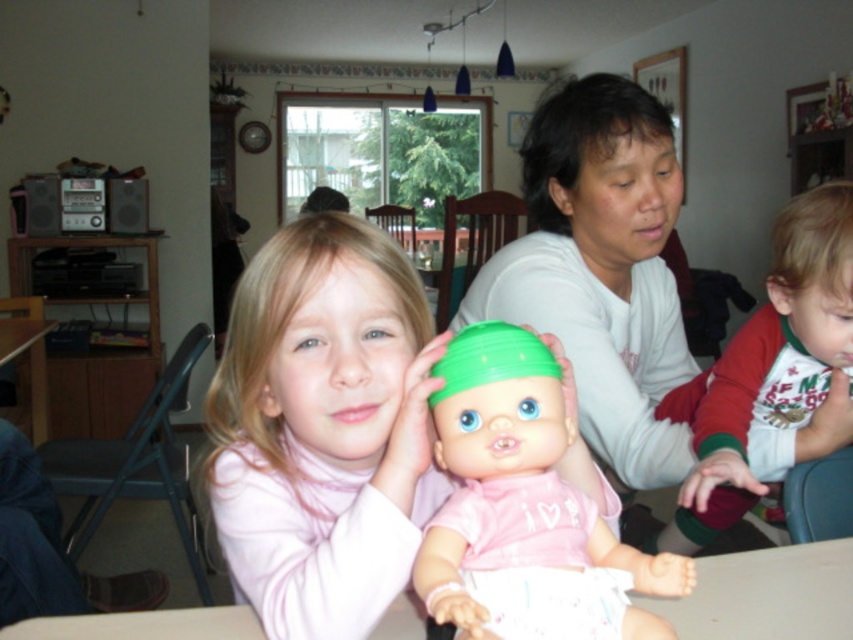
Between pink matte doll at center and white matte doll at center, which one appears on the left side from the viewer's perspective?

Positioned to the left is pink matte doll at center.

Locate an element on the screen. This screenshot has height=640, width=853. pink matte doll at center is located at coordinates (323, 428).

Find the location of a particular element. The width and height of the screenshot is (853, 640). pink matte doll at center is located at coordinates (323, 428).

Locate an element on the screen. The width and height of the screenshot is (853, 640). pink matte doll at center is located at coordinates (323, 428).

Does white matte doll at center appear over green plastic doll at center?

Correct, white matte doll at center is located above green plastic doll at center.

Between white matte doll at center and green plastic doll at center, which one appears on the right side from the viewer's perspective?

From the viewer's perspective, white matte doll at center appears more on the right side.

Between point (554, 172) and point (550, 467), which one is positioned behind?

The point (554, 172) is more distant.

Identify the location of white matte doll at center. (601, 269).

Is the position of green plastic doll at center more distant than that of red fleece pajamas at lower right?

No, green plastic doll at center is closer to the viewer.

Between green plastic doll at center and red fleece pajamas at lower right, which one has more height?

red fleece pajamas at lower right

Is point (645, 582) less distant than point (830, 246)?

That is True.

The width and height of the screenshot is (853, 640). Find the location of `green plastic doll at center`. green plastic doll at center is located at coordinates (520, 493).